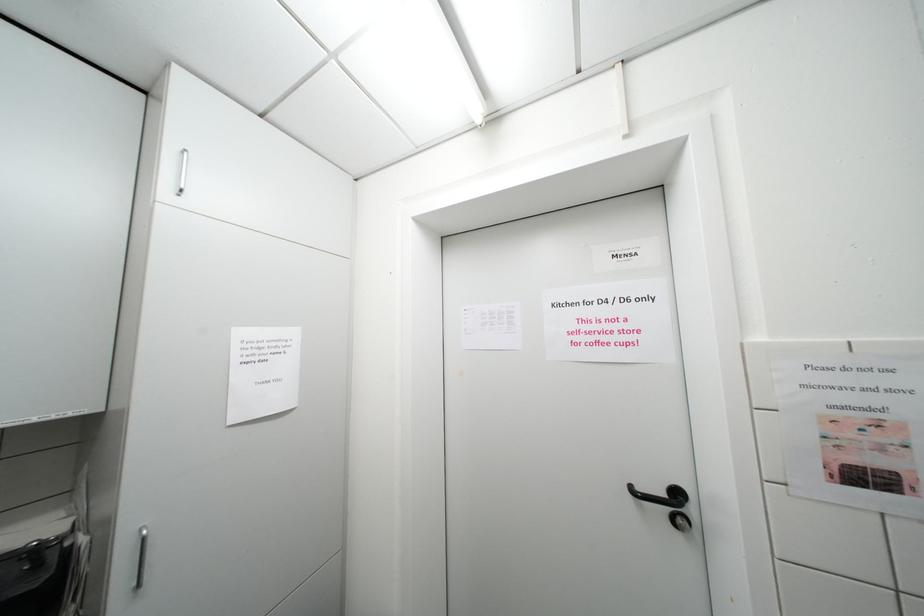
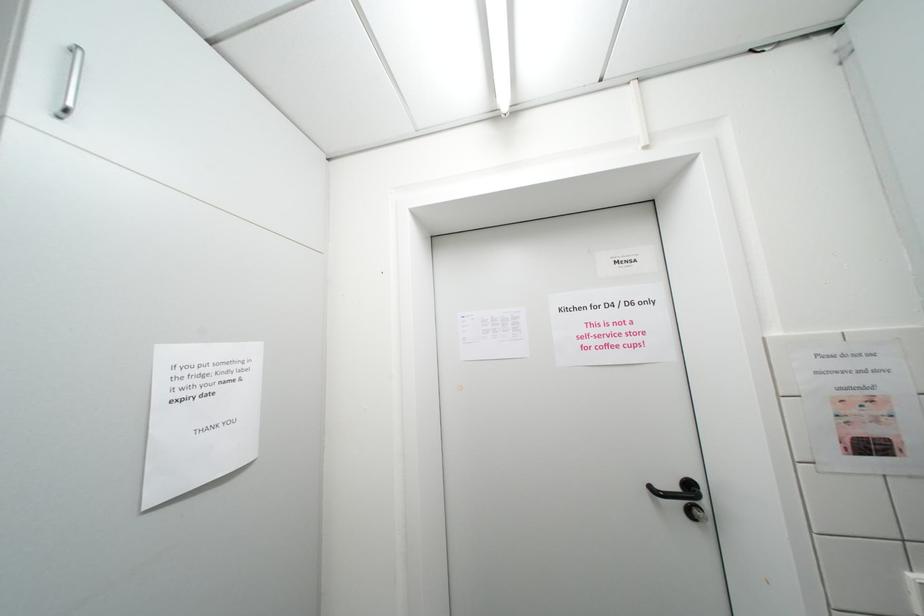
Question: The first image is from the beginning of the video and the second image is from the end. How did the camera likely rotate when shooting the video?

Choices:
 (A) Left
 (B) Right
 (C) Up
 (D) Down

Answer: (B)